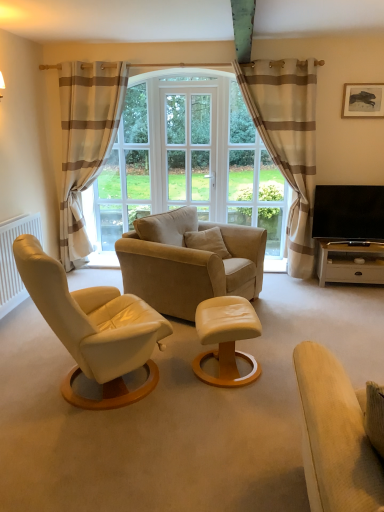
This screenshot has height=512, width=384. What do you see at coordinates (226, 338) in the screenshot?
I see `matte leather ottoman at center, which is the second table in back-to-front order` at bounding box center [226, 338].

How much space does beige striped curtain at left, placed as the 1th curtain when sorted from left to right, occupy vertically?

7.35 feet.

Find the location of `black glossy tv at right`. black glossy tv at right is located at coordinates (349, 212).

The width and height of the screenshot is (384, 512). What do you see at coordinates (349, 263) in the screenshot? I see `white glossy table at right, which is the first table from back to front` at bounding box center [349, 263].

Locate an element on the screen. white glossy table at right, which ranks as the first table in right-to-left order is located at coordinates (349, 263).

At what (x,y) coordinates should I click in order to perform the action: click on light beige fabric studio couch at lower right. Please return your answer as a coordinate pair (x, y). This screenshot has height=512, width=384. Looking at the image, I should click on (335, 436).

In order to face suede beige armchair at center, should I rotate leftwards or rightwards?

Turn right by 0.554 degrees to look at suede beige armchair at center.

The width and height of the screenshot is (384, 512). Describe the element at coordinates (188, 263) in the screenshot. I see `suede beige armchair at center` at that location.

Image resolution: width=384 pixels, height=512 pixels. I want to click on matte leather ottoman at center, acting as the second table starting from the right, so click(226, 338).

Are matte leather ottoman at center, which is the second table from top to bottom, and light beige fabric studio couch at lower right far apart?

Yes.

Can you confirm if matte leather ottoman at center, acting as the second table starting from the right, is smaller than light beige fabric studio couch at lower right?

Yes, matte leather ottoman at center, acting as the second table starting from the right, is smaller than light beige fabric studio couch at lower right.

Considering the sizes of matte leather ottoman at center, which is the 1th table in left-to-right order, and light beige fabric studio couch at lower right in the image, is matte leather ottoman at center, which is the 1th table in left-to-right order, taller or shorter than light beige fabric studio couch at lower right?

Clearly, matte leather ottoman at center, which is the 1th table in left-to-right order, is shorter compared to light beige fabric studio couch at lower right.

Find the location of a particular element. This screenshot has height=512, width=384. studio couch above the matte leather ottoman at center, acting as the second table starting from the right (from a real-world perspective) is located at coordinates (335, 436).

How many degrees apart are the facing directions of matte leather ottoman at center, acting as the second table starting from the right, and beige striped curtain at right, which is the first curtain in right-to-left order?

99.5 degrees.

Consider the image. Which is less distant, (x=234, y=362) or (x=256, y=76)?

Point (x=234, y=362) appears to be closer to the viewer than point (x=256, y=76).

Can you confirm if matte leather ottoman at center, which is counted as the first table, starting from the front, is positioned to the right of beige striped curtain at right, placed as the second curtain when sorted from left to right?

No.

Could you tell me if matte leather ottoman at center, which is counted as the first table, starting from the front, is turned towards beige striped curtain at right, placed as the second curtain when sorted from left to right?

No, matte leather ottoman at center, which is counted as the first table, starting from the front, does not turn towards beige striped curtain at right, placed as the second curtain when sorted from left to right.

Does white glossy table at right, which appears as the second table when viewed from the left, have a greater height compared to matte leather ottoman at center, which is counted as the first table, starting from the front?

No.

Who is more distant, white glossy table at right, which appears as the second table when viewed from the left, or matte leather ottoman at center, which is counted as the first table, starting from the front?

white glossy table at right, which appears as the second table when viewed from the left, is behind.

Which is nearer, (342, 259) or (230, 310)?

Point (342, 259) is farther from the camera than point (230, 310).

From their relative heights in the image, would you say white glass screen door at center is taller or shorter than suede beige armchair at center?

In the image, white glass screen door at center appears to be taller than suede beige armchair at center.

Is white glass screen door at center in front of or behind suede beige armchair at center in the image?

In the image, white glass screen door at center appears behind suede beige armchair at center.

Considering the sizes of objects white glass screen door at center and suede beige armchair at center in the image provided, who is wider, white glass screen door at center or suede beige armchair at center?

With larger width is suede beige armchair at center.

Measure the distance between white glass screen door at center and suede beige armchair at center.

white glass screen door at center and suede beige armchair at center are 5.07 feet apart.

Is point (343, 502) positioned in front of point (281, 122)?

Yes, it is.

Could you measure the distance between light beige fabric studio couch at lower right and beige striped curtain at right, placed as the second curtain when sorted from left to right?

A distance of 3.08 meters exists between light beige fabric studio couch at lower right and beige striped curtain at right, placed as the second curtain when sorted from left to right.

Is light beige fabric studio couch at lower right oriented away from beige striped curtain at right, which is the first curtain in right-to-left order?

light beige fabric studio couch at lower right is not turned away from beige striped curtain at right, which is the first curtain in right-to-left order.

Is light beige fabric studio couch at lower right wider than beige striped curtain at right, placed as the second curtain when sorted from left to right?

Correct, the width of light beige fabric studio couch at lower right exceeds that of beige striped curtain at right, placed as the second curtain when sorted from left to right.

Would you consider black glossy tv at right to be distant from suede beige armchair at center?

Yes.

Could you tell me if black glossy tv at right is turned towards suede beige armchair at center?

No, black glossy tv at right is not aimed at suede beige armchair at center.

From the image's perspective, would you say black glossy tv at right is shown under suede beige armchair at center?

No, from the image's perspective, black glossy tv at right is not below suede beige armchair at center.

Between black glossy tv at right and white glossy table at right, acting as the second table starting from the front, which one has larger width?

With larger width is white glossy table at right, acting as the second table starting from the front.

Is point (327, 191) closer or farther from the camera than point (347, 259)?

Point (327, 191).

Measure the distance from black glossy tv at right to white glossy table at right, acting as the second table starting from the front.

27.35 centimeters.

Which object is more forward, black glossy tv at right or white glossy table at right, which is the first table from back to front?

black glossy tv at right is in front.

The height and width of the screenshot is (512, 384). Identify the location of the 1st table behind the light beige fabric studio couch at lower right, starting your count from the anchor. (226, 338).

Locate an element on the screen. This screenshot has width=384, height=512. curtain located on the right of matte leather ottoman at center, which is the second table in back-to-front order is located at coordinates (287, 140).

Considering their positions, is light beige fabric studio couch at lower right positioned closer to white matte radiator at left than suede beige armchair at center?

suede beige armchair at center is positioned closer to the anchor white matte radiator at left.

In the scene shown: Which object lies nearer to the anchor point wooden framed picture at upper right, suede beige armchair at center or beige striped curtain at right, which is the first curtain in right-to-left order?

Among the two, beige striped curtain at right, which is the first curtain in right-to-left order, is located nearer to wooden framed picture at upper right.

Estimate the real-world distances between objects in this image. Which object is closer to suede beige armchair at center, beige striped curtain at left, placed as the 1th curtain when sorted from left to right, or beige striped curtain at right, which is the first curtain in right-to-left order?

Based on the image, beige striped curtain at right, which is the first curtain in right-to-left order, appears to be nearer to suede beige armchair at center.

Based on the photo, based on their spatial positions, is beige striped curtain at left, placed as the 1th curtain when sorted from left to right, or matte leather ottoman at center, which is counted as the first table, starting from the front, closer to white glass screen door at center?

beige striped curtain at left, placed as the 1th curtain when sorted from left to right, is closer to white glass screen door at center.

Estimate the real-world distances between objects in this image. Which object is further from beige striped curtain at right, which is the first curtain in right-to-left order, wooden framed picture at upper right or light beige fabric studio couch at lower right?

light beige fabric studio couch at lower right lies further to beige striped curtain at right, which is the first curtain in right-to-left order, than the other object.

Based on their spatial positions, is white glossy table at right, which ranks as the first table in right-to-left order, or suede beige armchair at center closer to white glass screen door at center?

suede beige armchair at center is positioned closer to the anchor white glass screen door at center.

When comparing their distances from beige striped curtain at left, which appears as the 2th curtain when viewed from the right, does black glossy tv at right or white matte radiator at left seem closer?

white matte radiator at left.

Based on their spatial positions, is wooden framed picture at upper right or white glass screen door at center closer to white matte radiator at left?

white glass screen door at center is closer to white matte radiator at left.

Where is `chair between clear glass window at center and white glossy table at right, which is counted as the first table, starting from the top, in the horizontal direction`? The height and width of the screenshot is (512, 384). chair between clear glass window at center and white glossy table at right, which is counted as the first table, starting from the top, in the horizontal direction is located at coordinates (188, 263).

You are a GUI agent. You are given a task and a screenshot of the screen. Output one action in this format:
    pyautogui.click(x=<x>, y=<y>)
    Task: Click on the curtain between suede beige armchair at center and wooden framed picture at upper right in the horizontal direction
    The image size is (384, 512).
    Given the screenshot: What is the action you would take?
    pyautogui.click(x=287, y=140)

Find the location of a particular element. table situated between beige striped curtain at left, which appears as the 2th curtain when viewed from the right, and black glossy tv at right from left to right is located at coordinates (226, 338).

Find the location of `screen door between clear glass window at center and wooden framed picture at upper right`. screen door between clear glass window at center and wooden framed picture at upper right is located at coordinates (189, 149).